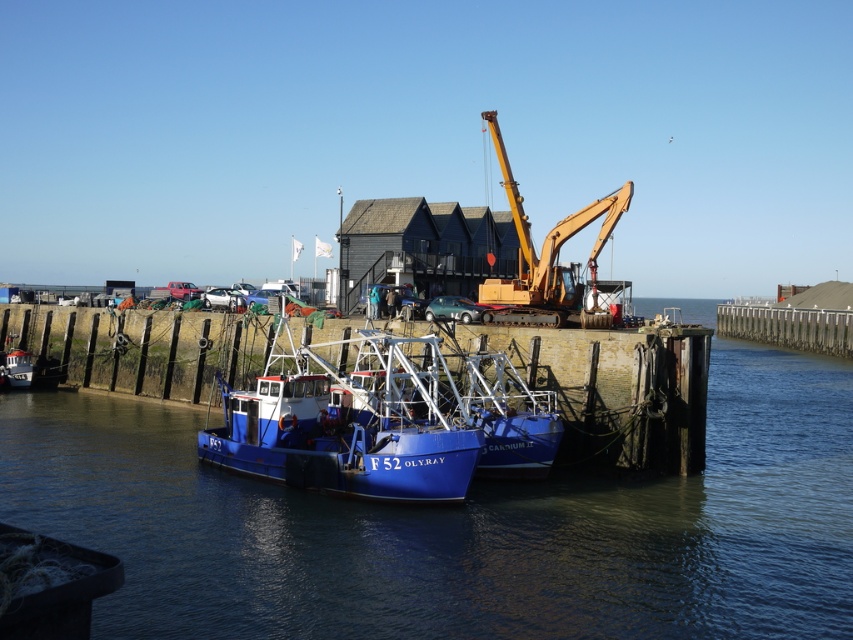
You are standing at the point with coordinates point (x=347, y=381) and want to walk to the point (x=675, y=528). Based on the scene description, which direction should you move to reach your destination?

You should move forward because point (x=675, y=528) is in front of point (x=347, y=381).

You are standing on the pier and want to know which object takes up more space in the image between the blue water at center and the blue matte boat at center. Which one is larger?

The blue water at center is bigger than the blue matte boat at center, so the blue water at center takes up more space in the image.